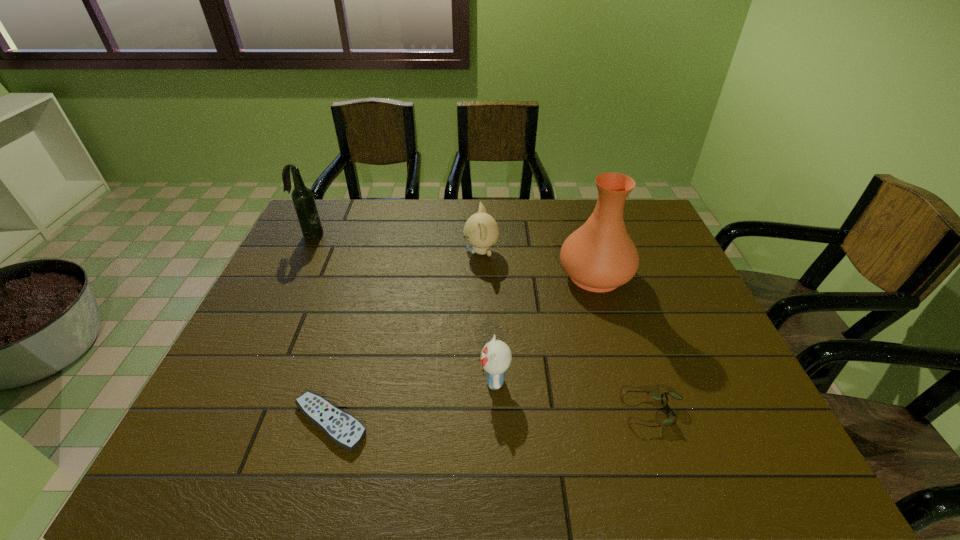
This screenshot has width=960, height=540. I want to click on vacant region located on the front of the leftmost object, so click(x=284, y=287).

At what (x,y) coordinates should I click in order to perform the action: click on vacant space located on the face of the farther kitten. Please return your answer as a coordinate pair (x, y). The width and height of the screenshot is (960, 540). Looking at the image, I should click on (386, 252).

The image size is (960, 540). I want to click on vacant space situated on the face of the farther kitten, so click(334, 252).

The width and height of the screenshot is (960, 540). Identify the location of vacant region located on the face of the farther kitten. (389, 252).

I want to click on vacant point located 0.050m on the front-facing side of the nearer kitten, so click(x=457, y=380).

The height and width of the screenshot is (540, 960). In order to click on vacant space located on the front-facing side of the nearer kitten in this screenshot , I will do `click(343, 380)`.

Locate an element on the screen. The height and width of the screenshot is (540, 960). vacant point located 0.220m on the front-facing side of the nearer kitten is located at coordinates (382, 380).

Find the location of a particular element. The image size is (960, 540). vacant space located 0.270m on the front-facing side of the fifth tallest object is located at coordinates (497, 413).

The height and width of the screenshot is (540, 960). I want to click on free space located on the front-facing side of the fifth tallest object, so click(567, 413).

You are a GUI agent. You are given a task and a screenshot of the screen. Output one action in this format:
    pyautogui.click(x=<x>, y=<y>)
    Task: Click on the vacant region located 0.060m on the front-facing side of the fifth tallest object
    The height and width of the screenshot is (540, 960).
    Given the screenshot: What is the action you would take?
    click(595, 413)